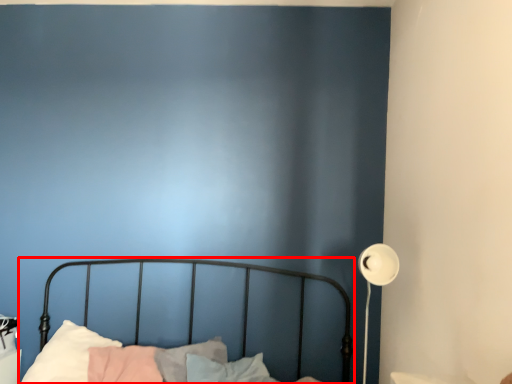
Question: Where is bed (annotated by the red box) located in relation to lamp in the image?

Choices:
 (A) right
 (B) left

Answer: (B)